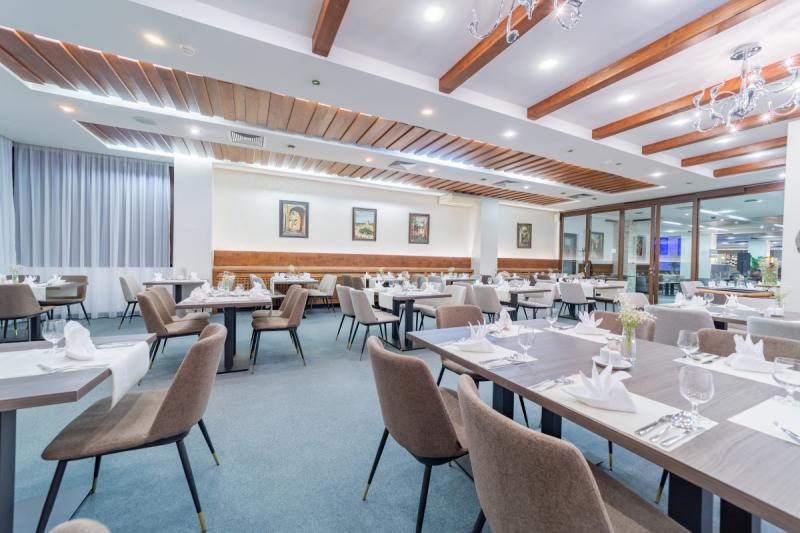
The width and height of the screenshot is (800, 533). Identify the location of ceiling beams. coord(766,165), coord(720,152), coord(678,138), coord(650,115), coord(582,87), coord(480,58), coord(324,29).